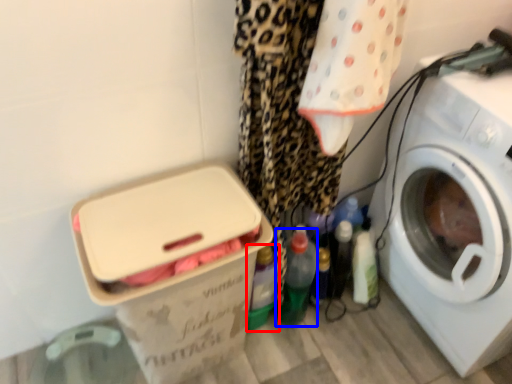
Question: Which of the following is the farthest to the observer, bottle (highlighted by a red box) or bottle (highlighted by a blue box)?

Choices:
 (A) bottle
 (B) bottle

Answer: (B)